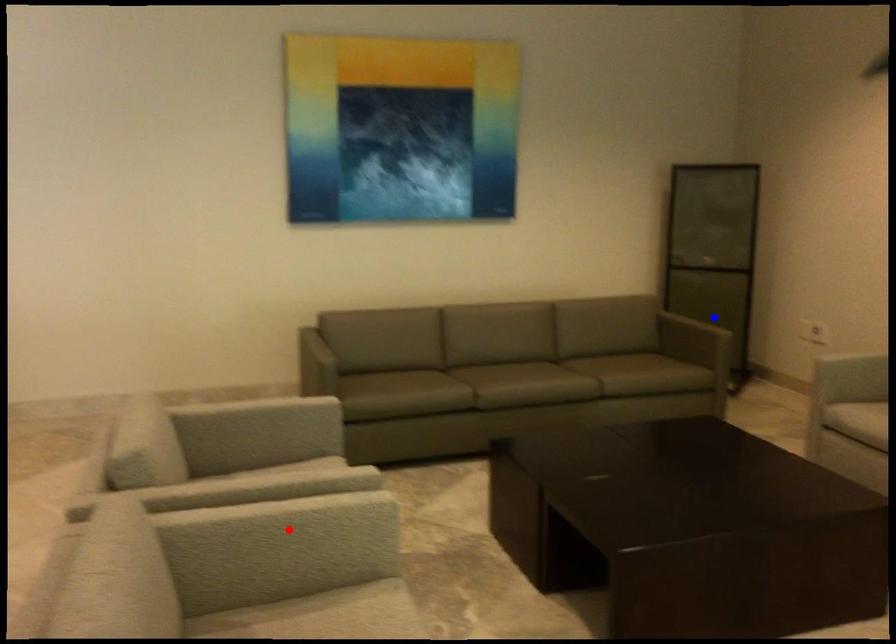
Question: In the image, two points are highlighted. Which point is nearer to the camera? Reply with the corresponding letter.

Choices:
 (A) blue point
 (B) red point

Answer: (B)